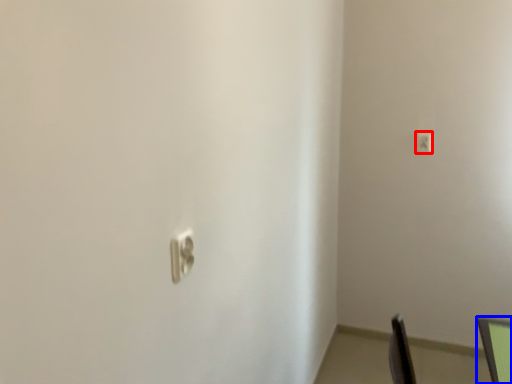
Question: Which object appears closest to the camera in this image, light switch (highlighted by a red box) or computer monitor (highlighted by a blue box)?

Choices:
 (A) light switch
 (B) computer monitor

Answer: (B)